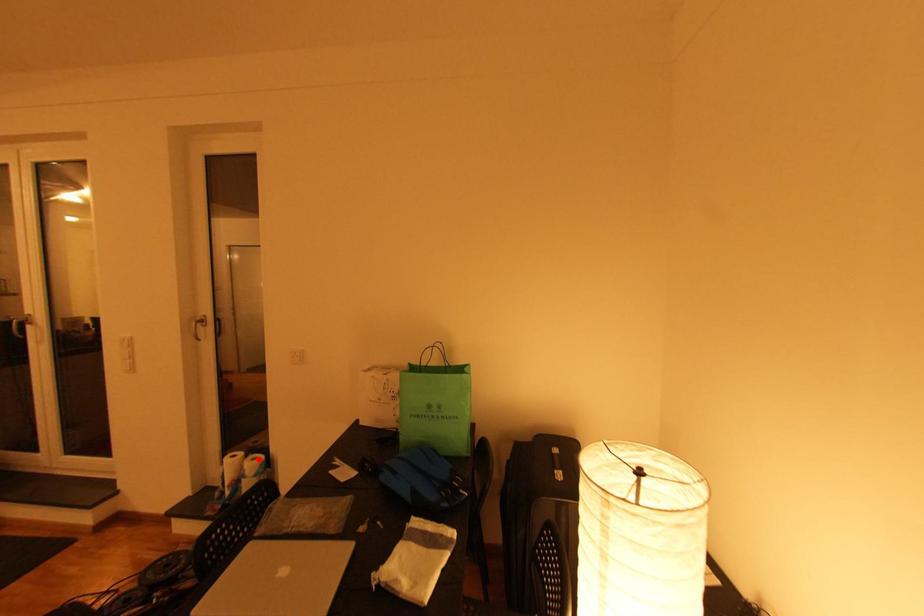
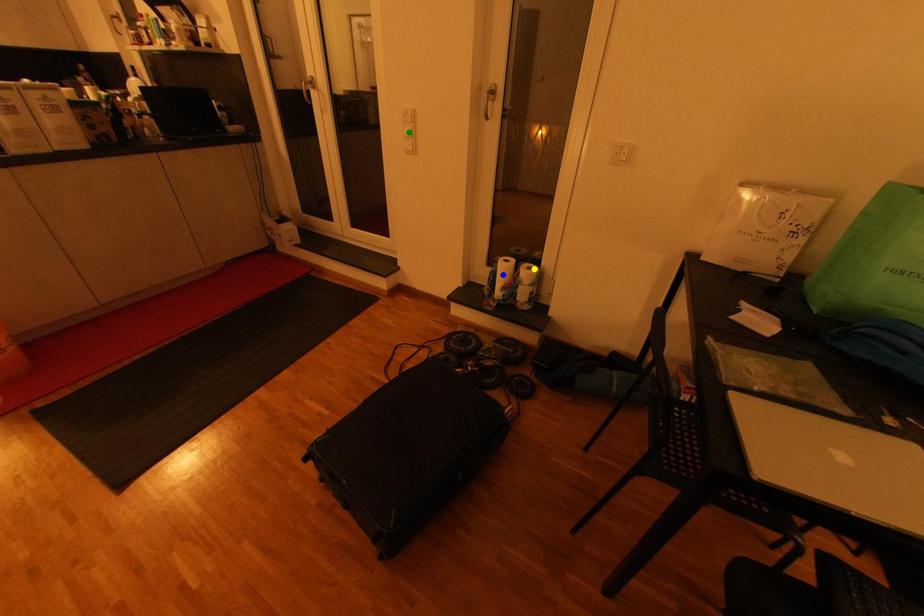
Question: I am providing you with two images of the same scene from different viewpoints. A red point is marked on the first image. You are given multiple points on the second image. Which point in image 2 represents the same 3d spot as the red point in image 1?

Choices:
 (A) yellow point
 (B) green point
 (C) blue point

Answer: (A)